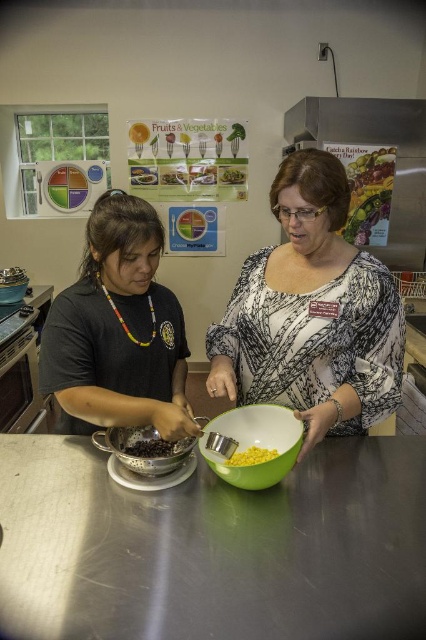
Question: Which object appears farthest from the camera in this image?

Choices:
 (A) black matte shirt at left
 (B) stainless steel counter at center
 (C) green plastic bowl at center
 (D) metallic silver bowl at center

Answer: (A)

Question: Among these points, which one is nearest to the camera?

Choices:
 (A) (101, 440)
 (B) (161, 440)
 (C) (201, 467)

Answer: (C)

Question: Is green plastic bowl at center in front of metallic silver bowl at center?

Choices:
 (A) no
 (B) yes

Answer: (B)

Question: Does white printed blouse at center have a smaller size compared to green plastic bowl at center?

Choices:
 (A) yes
 (B) no

Answer: (B)

Question: Which point is farther from the camera taking this photo?

Choices:
 (A) (328, 211)
 (B) (152, 468)

Answer: (A)

Question: Where is white printed blouse at center located in relation to green plastic bowl at center in the image?

Choices:
 (A) above
 (B) below

Answer: (A)